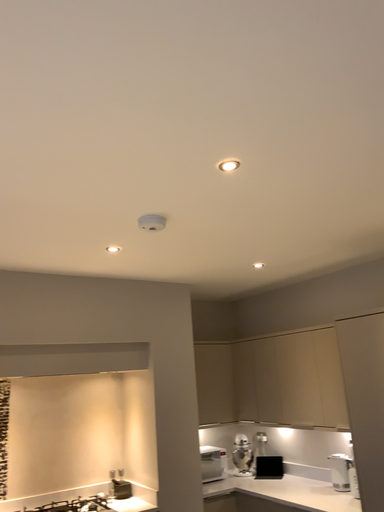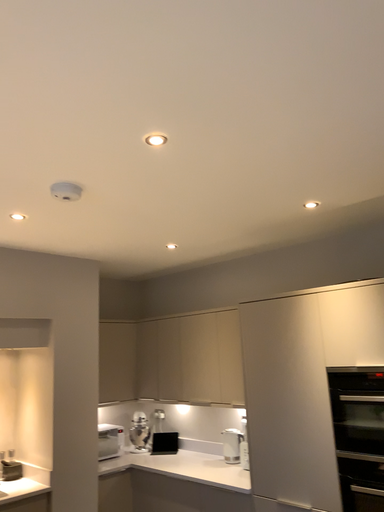
Question: How did the camera likely rotate when shooting the video?

Choices:
 (A) rotated right
 (B) rotated left

Answer: (A)